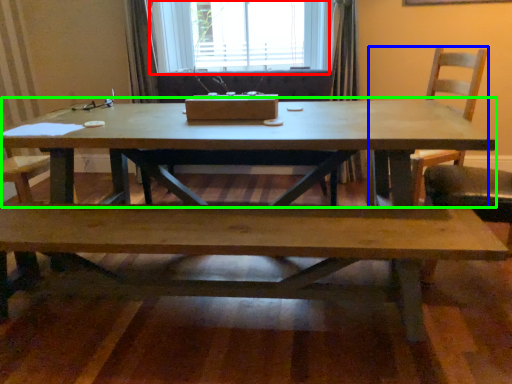
Question: Estimate the real-world distances between objects in this image. Which object is farther from window (highlighted by a red box), chair (highlighted by a blue box) or coffee table (highlighted by a green box)?

Choices:
 (A) chair
 (B) coffee table

Answer: (B)